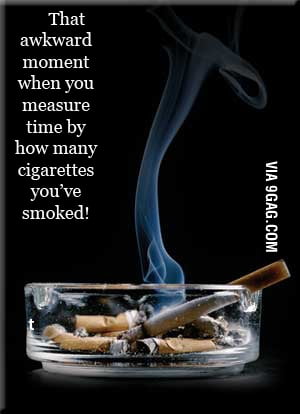
The height and width of the screenshot is (414, 300). I want to click on ashtray, so click(x=66, y=302).